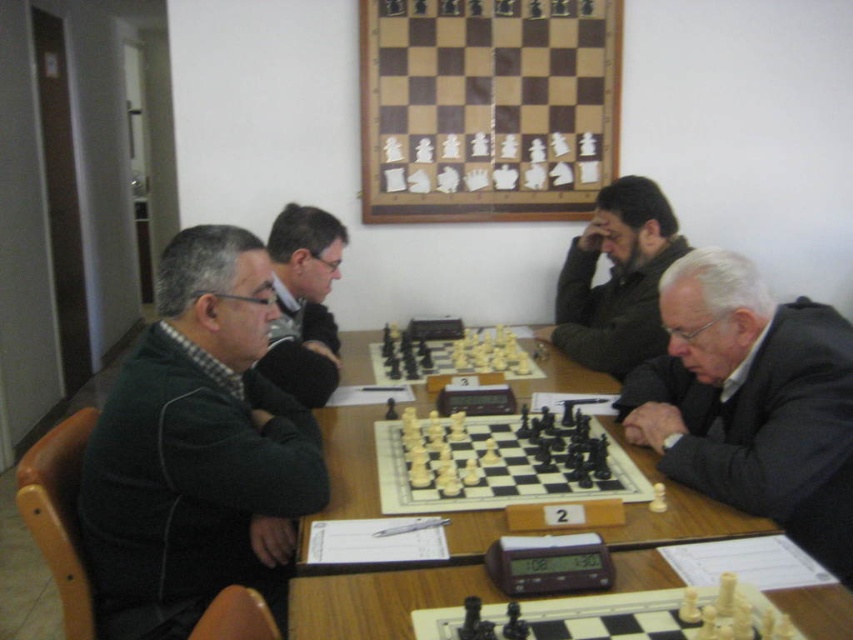
Is white plastic chess pieces at center taller than wooden chess set at center?

Incorrect, white plastic chess pieces at center's height is not larger of wooden chess set at center's.

Does point (445, 435) lie in front of point (515, 349)?

Yes.

Locate an element on the screen. The image size is (853, 640). white plastic chess pieces at center is located at coordinates (498, 461).

Who is positioned more to the left, dark green sweater at left or black wool suit at lower right?

dark green sweater at left is more to the left.

Is point (126, 484) closer to camera compared to point (701, 328)?

Yes, it is.

Identify the location of dark green sweater at left. (196, 451).

Where is `dark green sweater at left`? dark green sweater at left is located at coordinates (196, 451).

Measure the distance from white plastic chess pieces at center to wooden table at center.

white plastic chess pieces at center is 5.37 inches away from wooden table at center.

Based on the photo, is white plastic chess pieces at center shorter than wooden table at center?

Indeed, white plastic chess pieces at center has a lesser height compared to wooden table at center.

Who is more forward, (428,444) or (335,493)?

Point (335,493)

The height and width of the screenshot is (640, 853). Find the location of `white plastic chess pieces at center`. white plastic chess pieces at center is located at coordinates (498, 461).